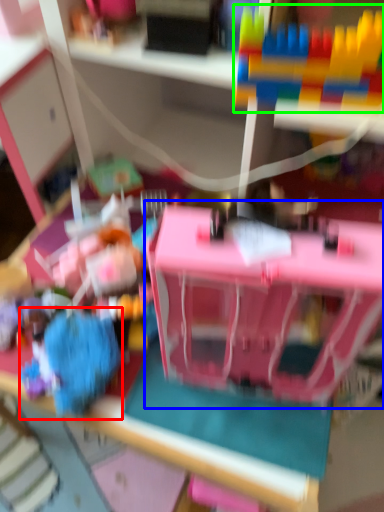
Question: Which is farther away from toy (highlighted by a red box)? toy (highlighted by a blue box) or toy (highlighted by a green box)?

Choices:
 (A) toy
 (B) toy

Answer: (B)